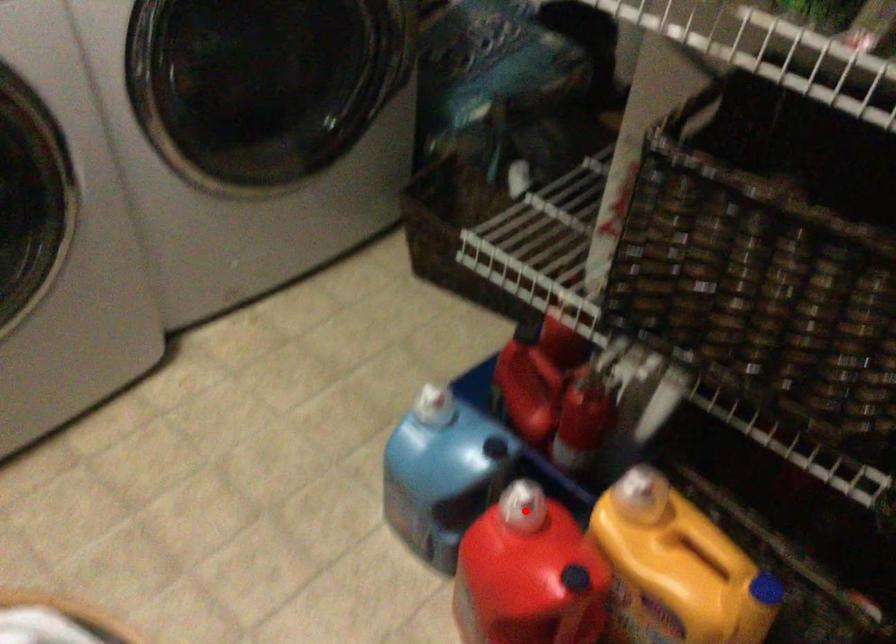
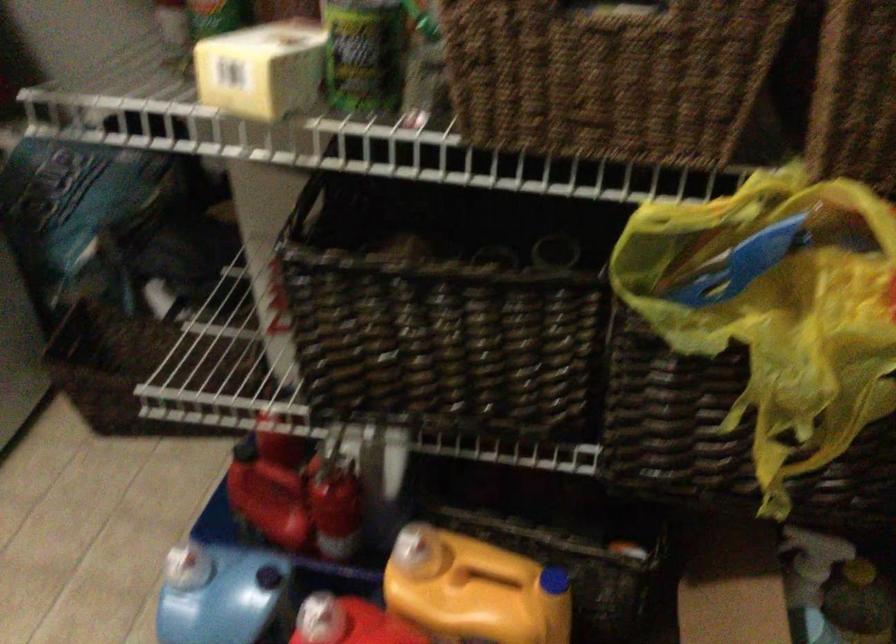
Locate, in the second image, the point that corresponds to the highlighted location in the first image.

(320, 619)